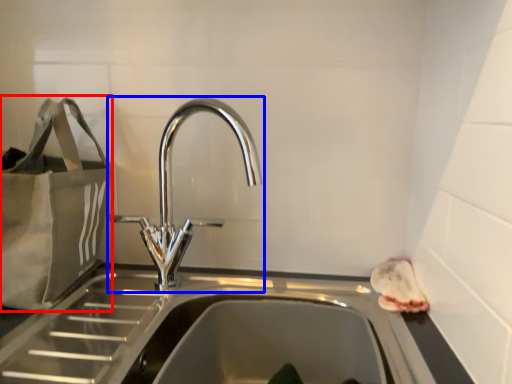
Question: Which point is further to the camera, bag (highlighted by a red box) or tap (highlighted by a blue box)?

Choices:
 (A) bag
 (B) tap

Answer: (A)